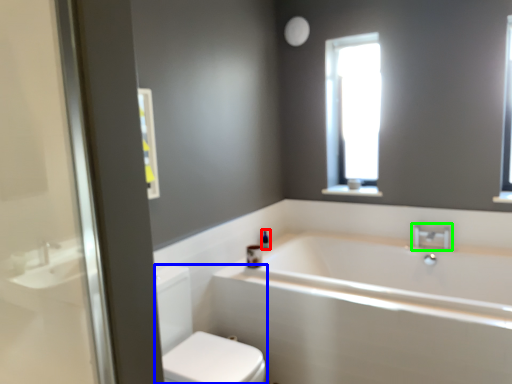
Question: Considering the real-world distances, which object is closest to toiletry (highlighted by a red box)? toilet bowl (highlighted by a blue box) or tap (highlighted by a green box).

Choices:
 (A) toilet bowl
 (B) tap

Answer: (A)